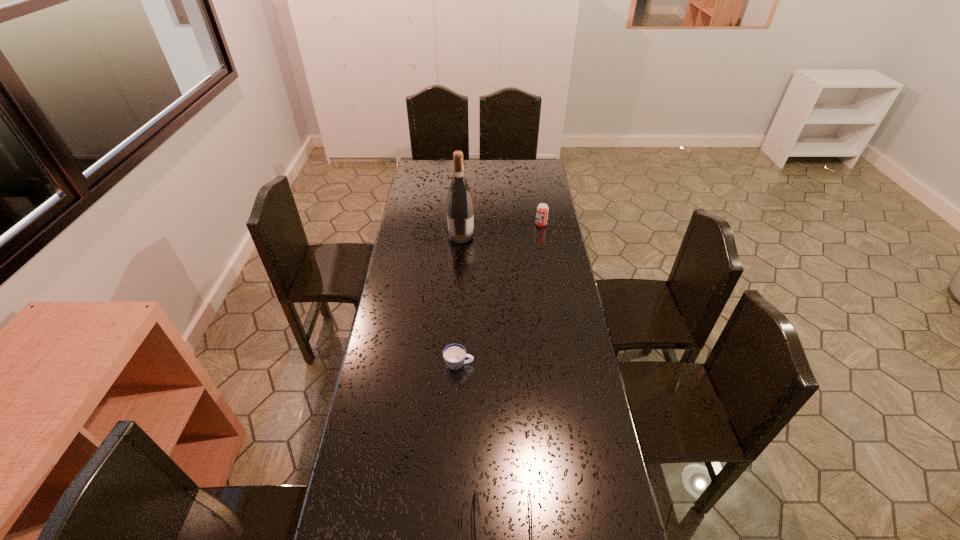
You are a GUI agent. You are given a task and a screenshot of the screen. Output one action in this format:
    pyautogui.click(x=<x>, y=<y>)
    Task: Click on the free spot between the rightmost object and the tallest object
    This screenshot has height=540, width=960.
    Given the screenshot: What is the action you would take?
    pyautogui.click(x=501, y=230)

This screenshot has height=540, width=960. What are the coordinates of `free space between the second nearest object and the farthest object` in the screenshot? It's located at (500, 294).

What are the coordinates of `the second closest object to the second shortest object` in the screenshot? It's located at (460, 209).

This screenshot has width=960, height=540. Identify the location of object that is the third closest one to the wine bottle. (474, 490).